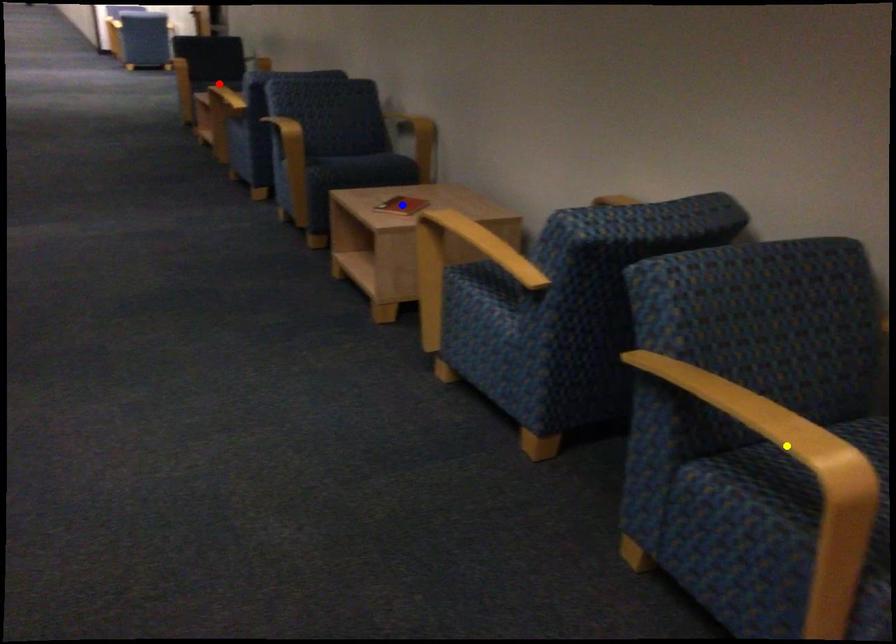
Order these from nearest to farthest:
1. red point
2. blue point
3. yellow point

1. yellow point
2. blue point
3. red point